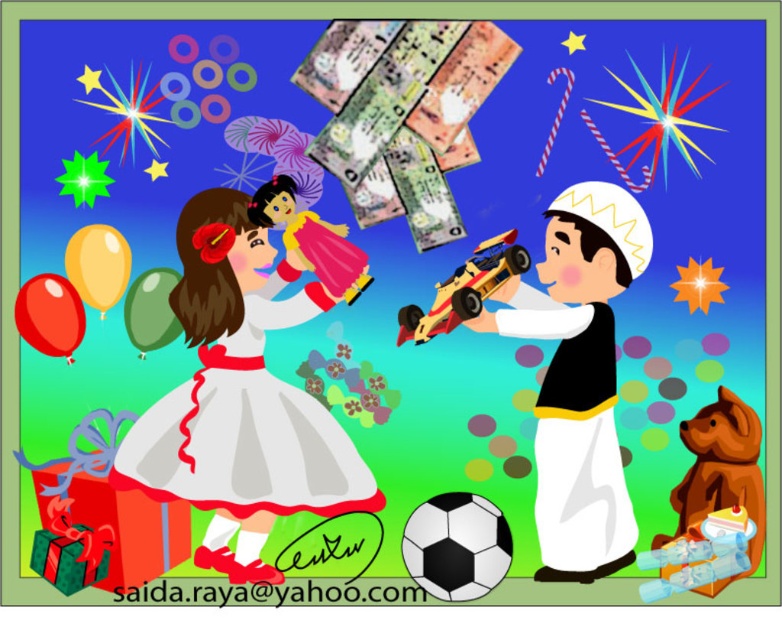
Which is behind, point (725, 512) or point (510, 253)?

The point (725, 512) is more distant.

This screenshot has width=782, height=640. Describe the element at coordinates (712, 504) in the screenshot. I see `brown plush bear at lower right` at that location.

Between point (748, 552) and point (418, 337), which one is positioned behind?

The point (748, 552) is behind.

At what (x,y) coordinates should I click in order to perform the action: click on brown plush bear at lower right. Please return your answer as a coordinate pair (x, y). This screenshot has width=782, height=640. Looking at the image, I should click on (712, 504).

Is yellow matte toy car at center further to the viewer compared to rubber balloon at lower left?

No, it is not.

Is point (504, 248) in front of point (41, 288)?

Yes, it is in front of point (41, 288).

Identify the location of yellow matte toy car at center. This screenshot has height=640, width=782. (465, 289).

Between point (730, 524) and point (664, 595), which one is positioned behind?

The point (664, 595) is more distant.

Which is in front, point (752, 524) or point (716, 531)?

Point (752, 524)

Find the location of `brown plush bear at lower right`. brown plush bear at lower right is located at coordinates (712, 504).

Identify the location of brown plush bear at lower right. (712, 504).